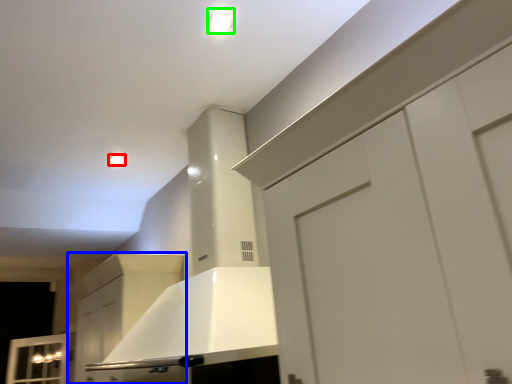
Question: Which object is the farthest from lighting (highlighted by a red box)? Choose among these: cabinetry (highlighted by a blue box) or lighting (highlighted by a green box).

Choices:
 (A) cabinetry
 (B) lighting

Answer: (B)